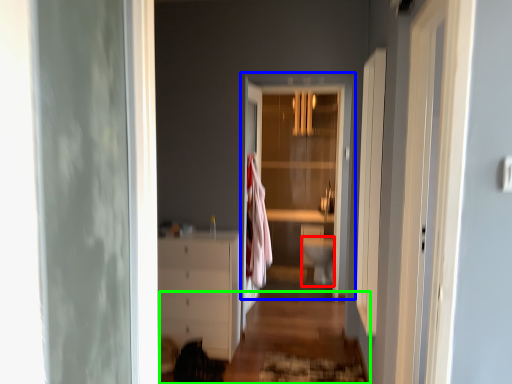
Question: Which object is positioned closest to toilet bowl (highlighted by a red box)? Select from door (highlighted by a blue box) and path (highlighted by a green box).

Choices:
 (A) door
 (B) path

Answer: (B)